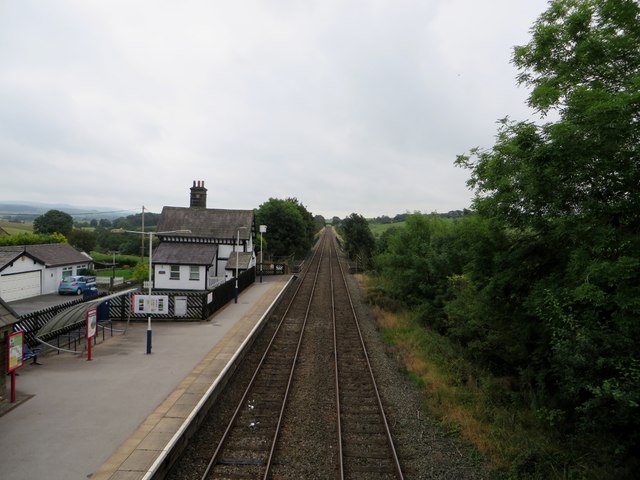
I want to click on windows, so click(192, 272), click(172, 273).